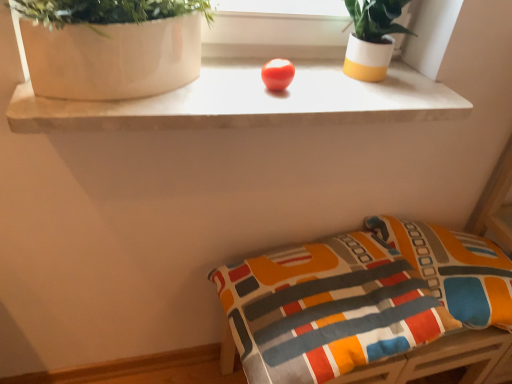
The width and height of the screenshot is (512, 384). I want to click on free location above matte white shelf at center (from a real-world perspective), so click(284, 91).